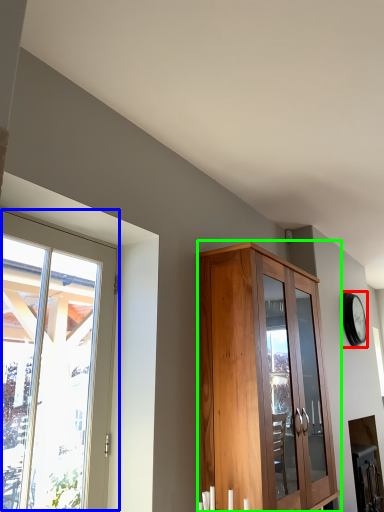
Question: Considering the real-world distances, which object is closest to clock (highlighted by a red box)? window (highlighted by a blue box) or cupboard (highlighted by a green box).

Choices:
 (A) window
 (B) cupboard

Answer: (B)